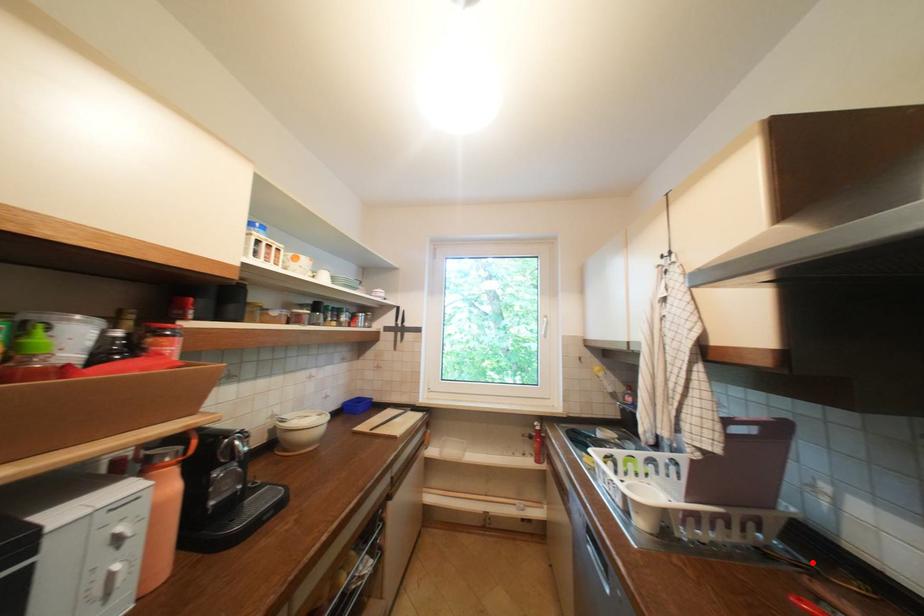
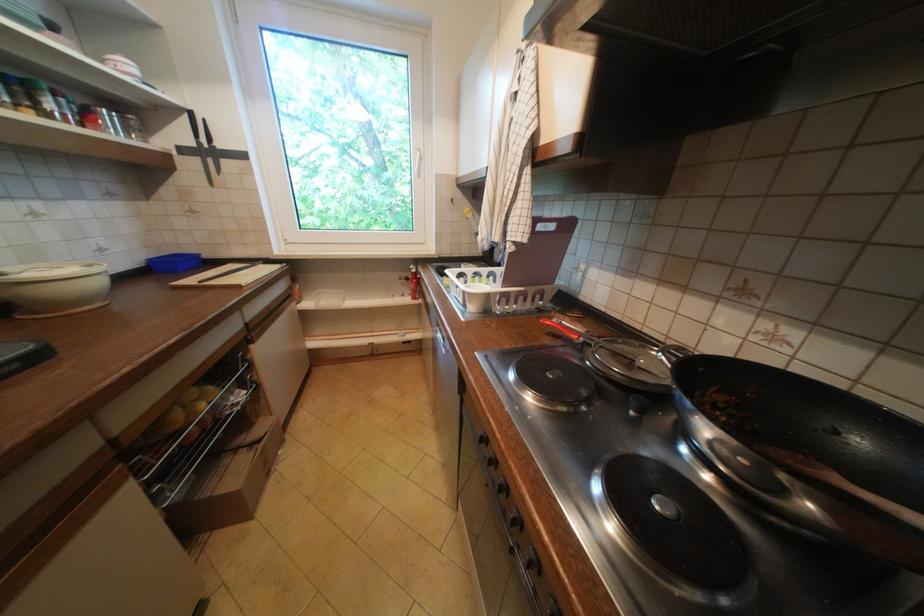
The point at the highlighted location is marked in the first image. Where is the corresponding point in the second image?

(565, 310)